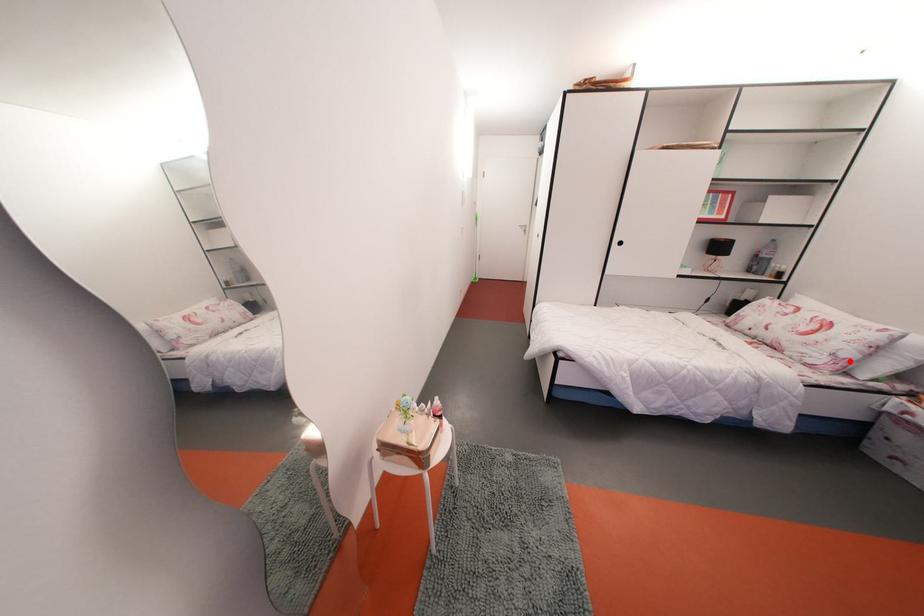
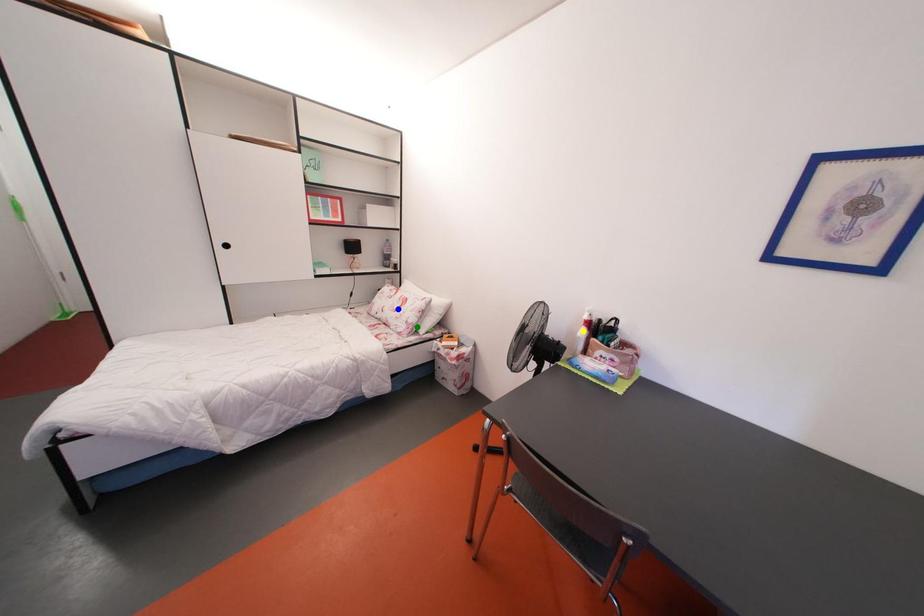
Question: I am providing you with two images of the same scene from different viewpoints. A red point is marked on the first image. You are given multiple points on the second image. Which point in image 2 represents the same 3d spot as the red point in image 1?

Choices:
 (A) yellow point
 (B) blue point
 (C) green point

Answer: (C)